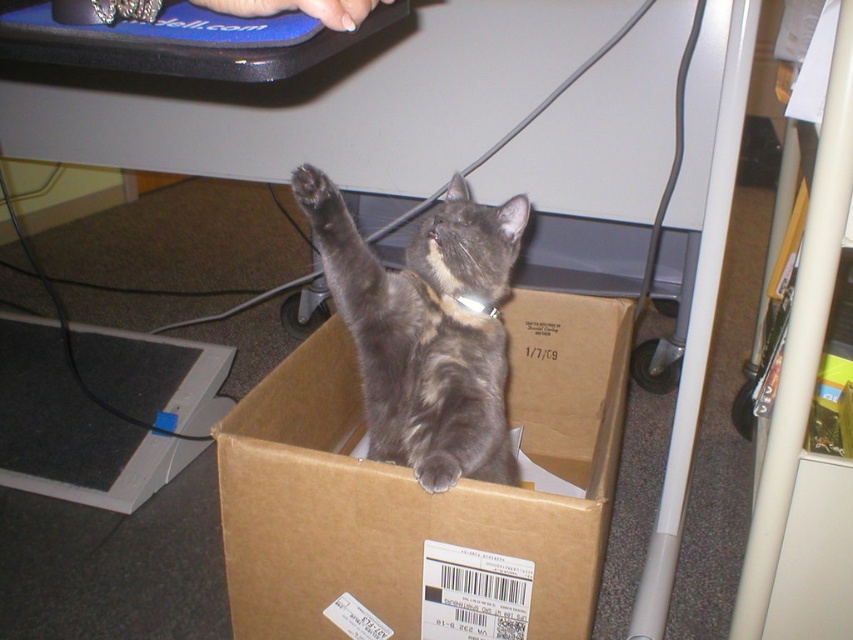
From the picture: You are holding a 50 cm long ruler and want to measure the distance from the camera to the point marked at coordinates point (305, 205). Can you determine if your ruler will be sufficient to measure this distance?

The distance from the camera to the point marked at coordinates point (305, 205) is 70.10 centimeters. Since the ruler is only 50 cm long, it is not long enough to measure the full distance. You will need a longer measuring tool.

You are a cat owner who wants to ensure your cat can comfortably sit inside the brown cardboard box at center while keeping its gray fur paw at lower center free to move. Based on the scene, is the box positioned in a way that allows the cat to have enough space for its paw?

The brown cardboard box at center is located below the gray fur paw at lower center, which means the cat has enough vertical space for its paw to move freely inside the box.

You are a toy mouse that wants to land on the gray fur paw at lower center. The brown cardboard box at center is in your path. Can you go around it without touching the box?

The brown cardboard box at center is closer to the viewer than gray fur paw at lower center, so the box is blocking the direct path. You can go around it by moving to the sides of the box to reach the gray fur paw at lower center without touching the box.